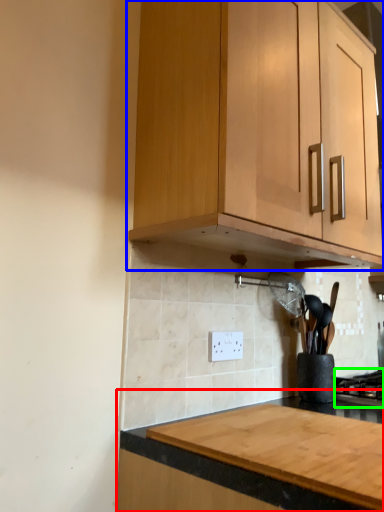
Question: Considering the real-world distances, which object is closest to countertop (highlighted by a red box)? cabinetry (highlighted by a blue box) or gas stove (highlighted by a green box).

Choices:
 (A) cabinetry
 (B) gas stove

Answer: (A)